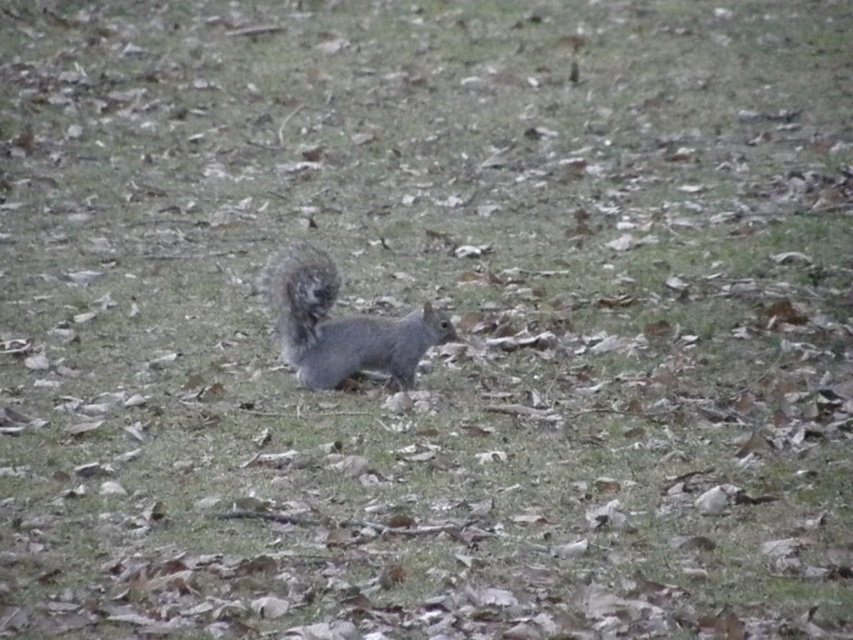
You are a wildlife photographer trying to capture a clear photo of the fuzzy gray squirrel at center and its fuzzy gray tail at center. Since you want to focus on the squirrel, which part should you zoom in on to ensure the squirrel takes up most of the frame?

The fuzzy gray squirrel at center is larger in size than the fuzzy gray tail at center, so you should zoom in on the fuzzy gray squirrel at center to ensure it takes up most of the frame.

You are a photographer setting up a camera to capture the squirrel in the scene. You have two markers, one at point (334, 291) and another at point (312, 253). Which marker is closer to the camera lens?

Point (334, 291) is further to the viewer than point (312, 253). Therefore, the marker at point (312, 253) is closer to the camera lens.

You are trying to determine if the fuzzy gray squirrel at center can fully hide behind a small bush that is just wide enough to cover the fuzzy gray tail at center. Based on their widths, will the squirrel be completely hidden?

The fuzzy gray squirrel at center might be wider than the fuzzy gray tail at center, so it may not be completely hidden behind the bush that can only cover the tail.